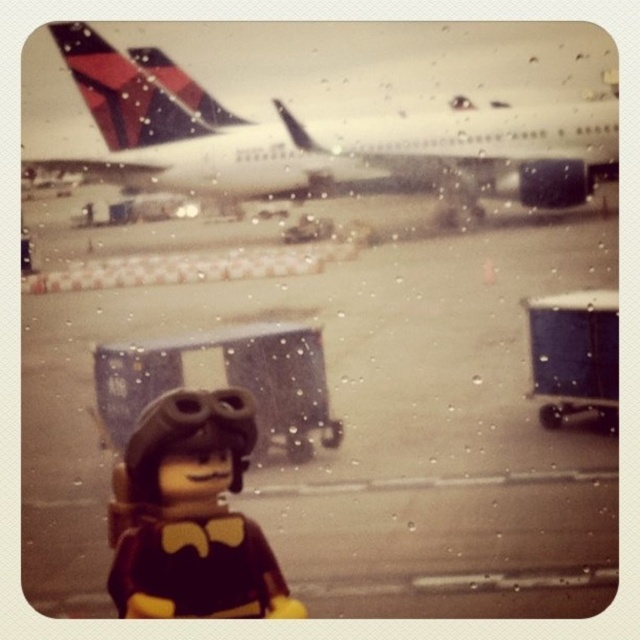
Which is below, smooth concrete tarmac at center or white matte airplane at upper center?

smooth concrete tarmac at center is lower down.

Is smooth concrete tarmac at center bigger than white matte airplane at upper center?

Yes, smooth concrete tarmac at center is bigger than white matte airplane at upper center.

Between point (452, 534) and point (298, 156), which one is positioned in front?

Point (452, 534) is in front.

Image resolution: width=640 pixels, height=640 pixels. In order to click on smooth concrete tarmac at center in this screenshot , I will do click(328, 376).